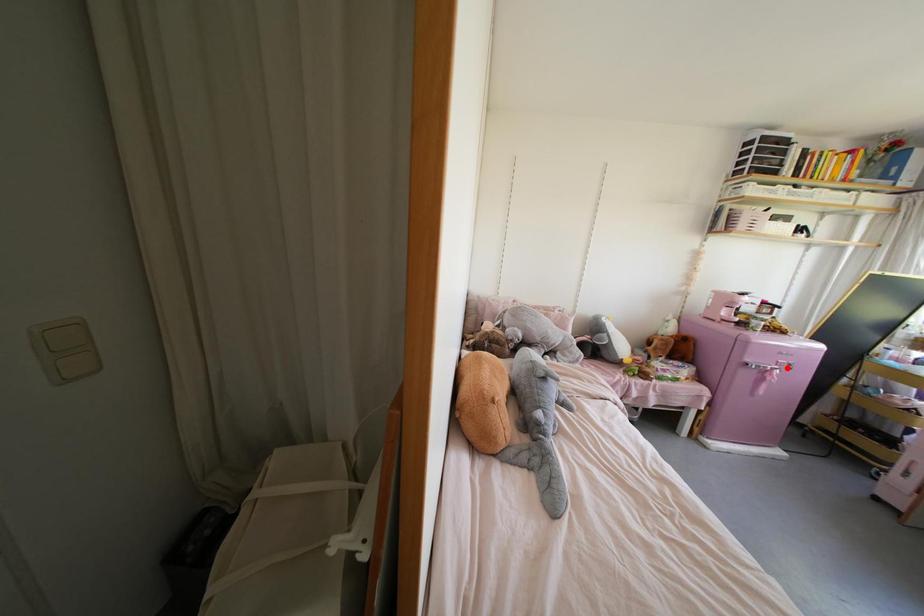
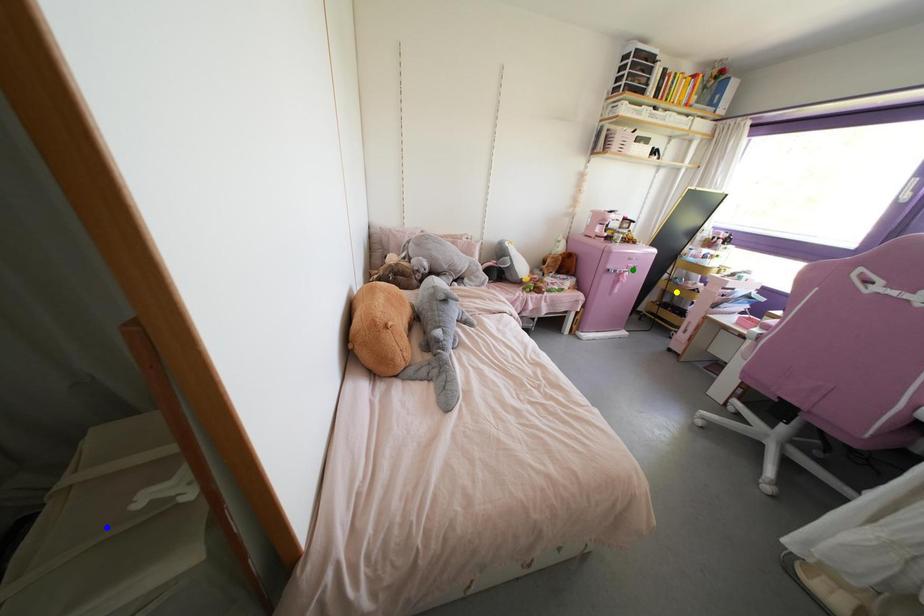
Question: I am providing you with two images of the same scene from different viewpoints. A red point is marked on the first image. You are given multiple points on the second image. Which point in image 2 represents the same 3d spot as the red point in image 1?

Choices:
 (A) blue point
 (B) yellow point
 (C) green point

Answer: (C)